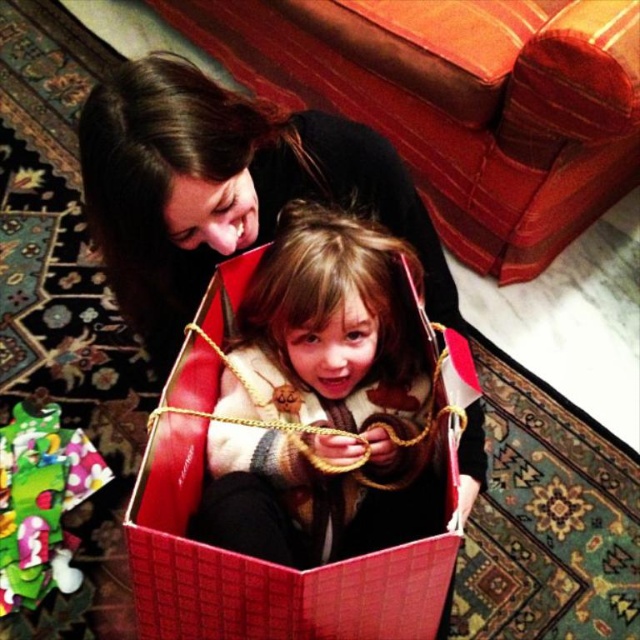
Is plaid sweater at center positioned behind matte black sweater at upper left?

Yes.

Find the location of a particular element. plaid sweater at center is located at coordinates (323, 397).

Is point (353, 282) in front of point (173, 337)?

Yes, it is in front of point (173, 337).

You are a GUI agent. You are given a task and a screenshot of the screen. Output one action in this format:
    pyautogui.click(x=<x>, y=<y>)
    Task: Click on the plaid sweater at center
    The image size is (640, 640).
    Given the screenshot: What is the action you would take?
    pyautogui.click(x=323, y=397)